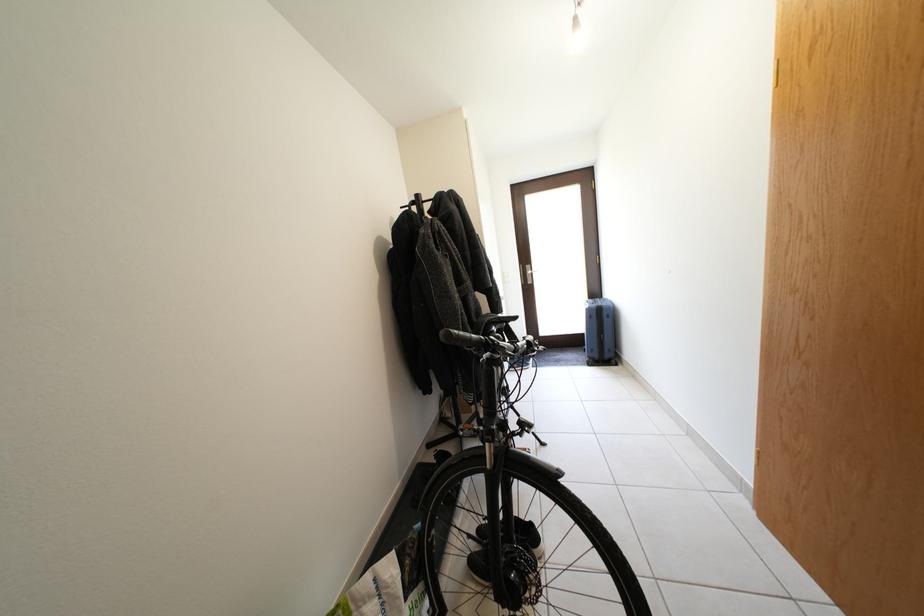
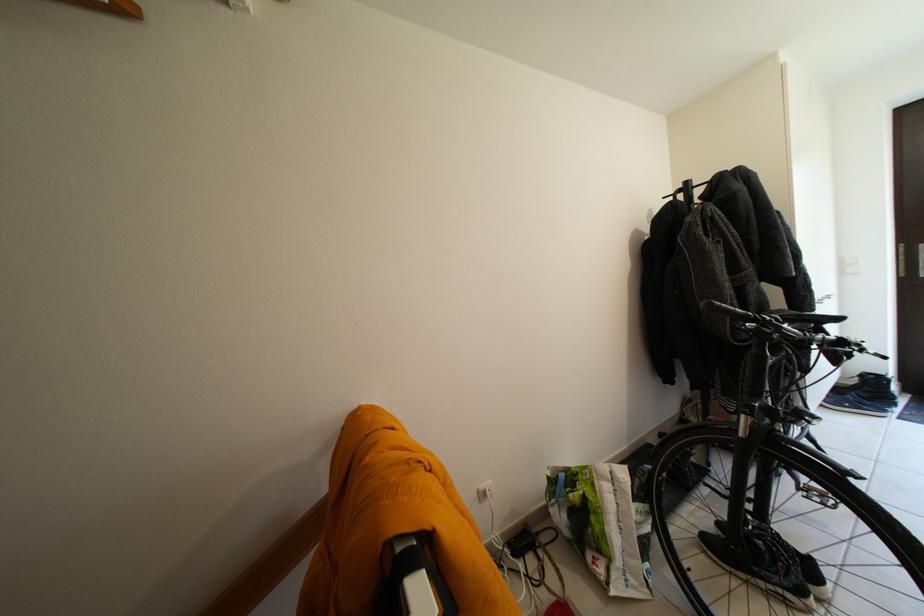
Where in the second image is the point corresponding to point 450,339 from the first image?

(711, 309)